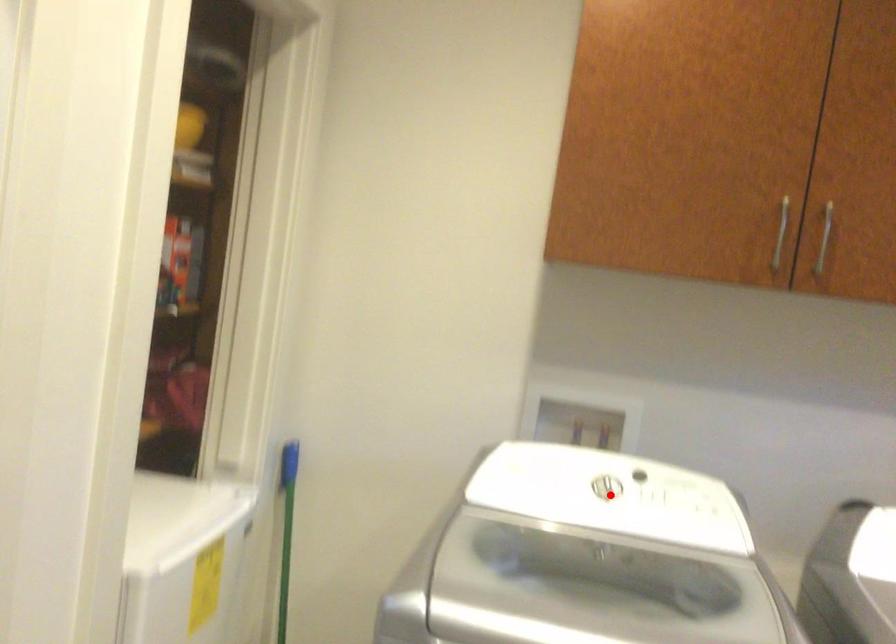
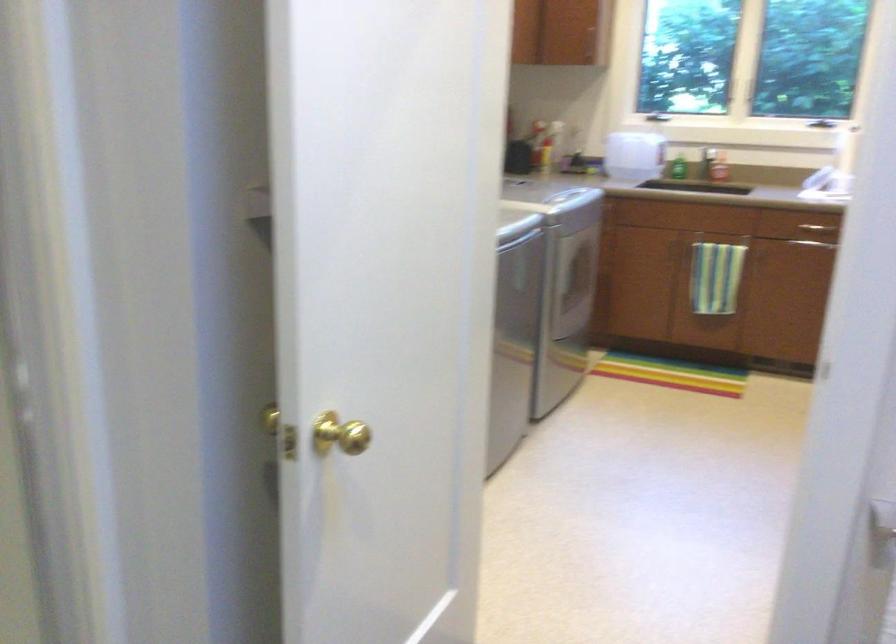
Question: I am providing you with two images of the same scene from different viewpoints. A red point is marked on the first image. Is the red point's position out of view in image 2?

Choices:
 (A) Yes
 (B) No

Answer: (A)